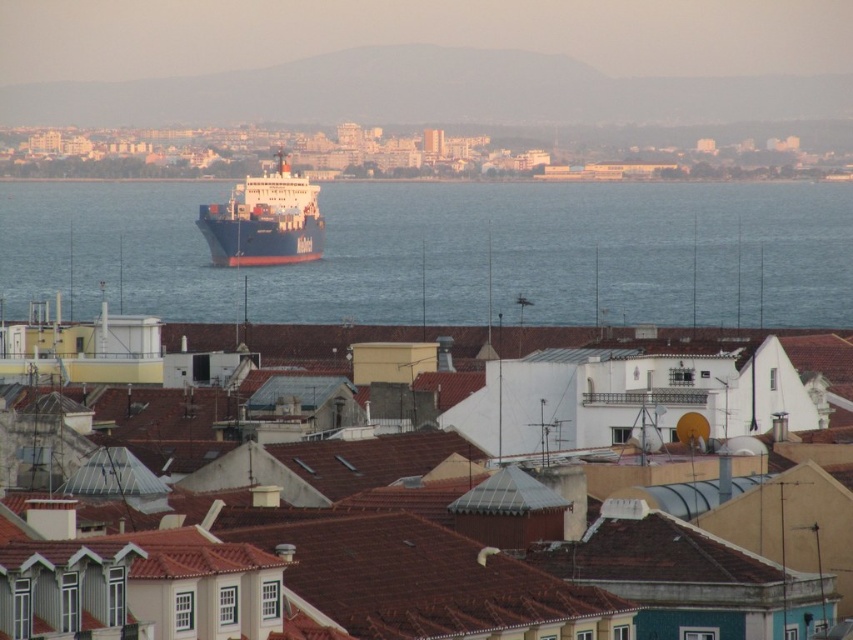
Question: Among these objects, which one is nearest to the camera?

Choices:
 (A) blue matte water at center
 (B) blue matte cargo ship at center

Answer: (A)

Question: Which of the following is the closest to the observer?

Choices:
 (A) blue matte water at center
 (B) blue matte cargo ship at center

Answer: (A)

Question: Can you confirm if blue matte water at center is bigger than blue matte cargo ship at center?

Choices:
 (A) no
 (B) yes

Answer: (B)

Question: Can you confirm if blue matte water at center is positioned to the left of blue matte cargo ship at center?

Choices:
 (A) yes
 (B) no

Answer: (B)

Question: Does blue matte water at center have a lesser width compared to blue matte cargo ship at center?

Choices:
 (A) no
 (B) yes

Answer: (A)

Question: Which object is closer to the camera taking this photo?

Choices:
 (A) blue matte water at center
 (B) blue matte cargo ship at center

Answer: (A)